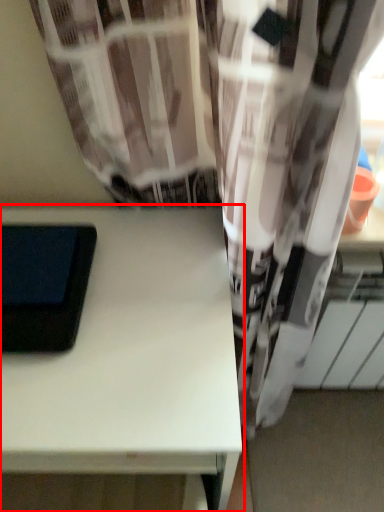
Question: In this image, where is table (annotated by the red box) located relative to ipad?

Choices:
 (A) left
 (B) right

Answer: (B)